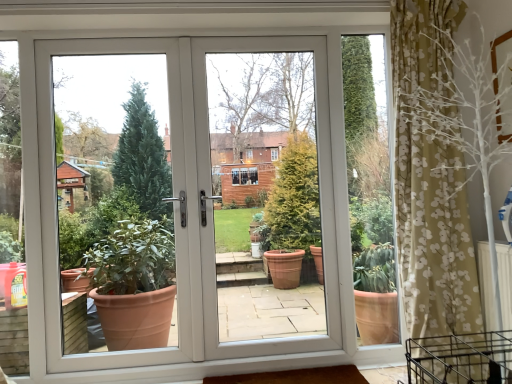
Where is `white plastic door at center`? white plastic door at center is located at coordinates (266, 195).

Describe the element at coordinates (266, 195) in the screenshot. I see `white plastic door at center` at that location.

This screenshot has height=384, width=512. What are the coordinates of `white plastic door at center` in the screenshot? It's located at (192, 196).

The width and height of the screenshot is (512, 384). Describe the element at coordinates (192, 196) in the screenshot. I see `white plastic door at center` at that location.

Locate an element on the screen. white plastic door at center is located at coordinates (266, 195).

Considering the relative positions of white plastic door at center and white plastic door at center in the image provided, is white plastic door at center to the left of white plastic door at center from the viewer's perspective?

Yes, white plastic door at center is to the left of white plastic door at center.

Who is more distant, white plastic door at center or white plastic door at center?

Positioned behind is white plastic door at center.

Between point (143, 255) and point (221, 188), which one is positioned behind?

Point (143, 255)

From the image's perspective, would you say white plastic door at center is positioned over white plastic door at center?

No, from the image's perspective, white plastic door at center is not over white plastic door at center.

From a real-world perspective, is white plastic door at center positioned above or below white plastic door at center?

From a real-world perspective, white plastic door at center is physically below white plastic door at center.

Considering the sizes of objects white plastic door at center and white plastic door at center in the image provided, who is wider, white plastic door at center or white plastic door at center?

Wider between the two is white plastic door at center.

In terms of height, does white plastic door at center look taller or shorter compared to white plastic door at center?

Considering their sizes, white plastic door at center has less height than white plastic door at center.

Considering the sizes of objects white plastic door at center and white plastic door at center in the image provided, who is smaller, white plastic door at center or white plastic door at center?

white plastic door at center.

Would you say white plastic door at center is outside white plastic door at center?

white plastic door at center is positioned outside white plastic door at center.

Are white plastic door at center and white plastic door at center far apart?

That's not correct — white plastic door at center is a little close to white plastic door at center.

Is white plastic door at center oriented towards white plastic door at center?

Yes, white plastic door at center faces towards white plastic door at center.

How distant is white plastic door at center from white plastic door at center?

A distance of 10.69 inches exists between white plastic door at center and white plastic door at center.

Where is `screen door located behind the white plastic door at center`? screen door located behind the white plastic door at center is located at coordinates (266, 195).

Considering the relative positions of white plastic door at center and white plastic door at center in the image provided, is white plastic door at center to the right of white plastic door at center from the viewer's perspective?

Yes, white plastic door at center is to the right of white plastic door at center.

Considering their positions, is white plastic door at center located in front of or behind white plastic door at center?

In the image, white plastic door at center appears behind white plastic door at center.

Is point (229, 285) positioned before point (99, 235)?

No, it is not.

From the image's perspective, is white plastic door at center located above white plastic door at center?

Yes.

From a real-world perspective, between white plastic door at center and white plastic door at center, who is vertically lower?

From a 3D spatial view, white plastic door at center is below.

Which object is wider, white plastic door at center or white plastic door at center?

white plastic door at center is wider.

Consider the image. Considering the relative sizes of white plastic door at center and white plastic door at center in the image provided, is white plastic door at center shorter than white plastic door at center?

Incorrect, the height of white plastic door at center does not fall short of that of white plastic door at center.

Considering the sizes of white plastic door at center and white plastic door at center in the image, is white plastic door at center bigger or smaller than white plastic door at center?

In the image, white plastic door at center appears to be smaller than white plastic door at center.

Is white plastic door at center inside the boundaries of white plastic door at center, or outside?

white plastic door at center is inside white plastic door at center.

Are white plastic door at center and white plastic door at center far apart?

That's not correct — white plastic door at center is a little close to white plastic door at center.

Is white plastic door at center aimed at white plastic door at center?

Yes, white plastic door at center is facing white plastic door at center.

The image size is (512, 384). In the image, there is a white plastic door at center. In order to click on door below it (from the image's perspective) in this screenshot , I will do `click(192, 196)`.

The height and width of the screenshot is (384, 512). In order to click on screen door above the white plastic door at center (from a real-world perspective) in this screenshot , I will do `click(266, 195)`.

Image resolution: width=512 pixels, height=384 pixels. In order to click on door below the white plastic door at center (from a real-world perspective) in this screenshot , I will do `click(192, 196)`.